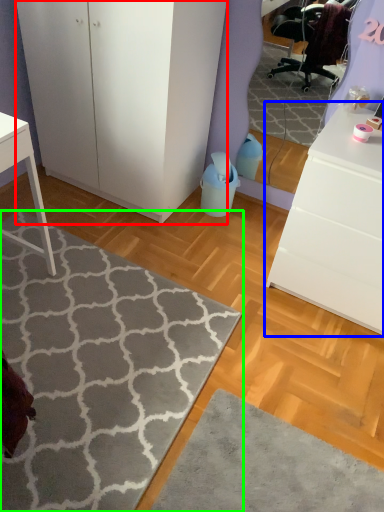
Question: Which object is the closest to the cabinetry (highlighted by a red box)? Choose among these: chest of drawers (highlighted by a blue box) or doormat (highlighted by a green box).

Choices:
 (A) chest of drawers
 (B) doormat

Answer: (B)